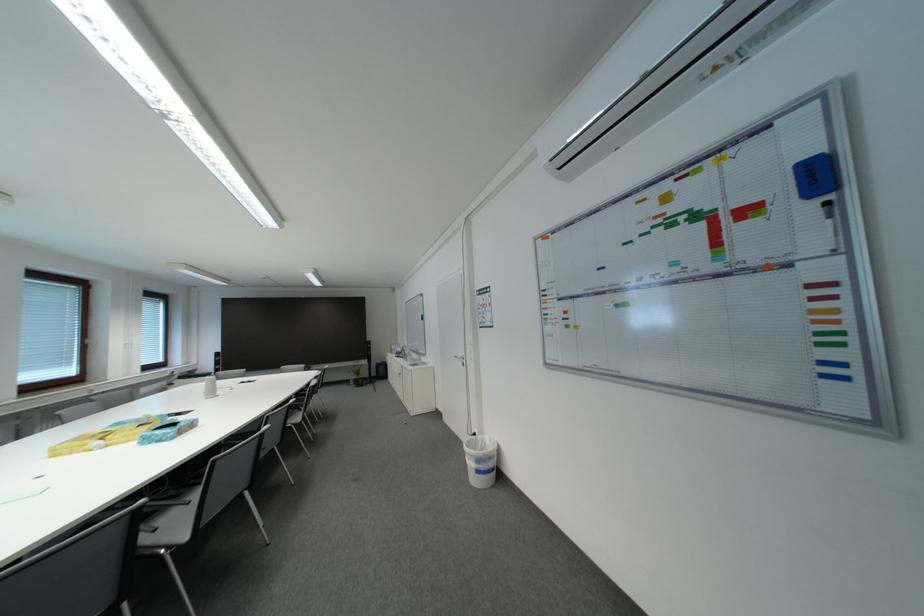
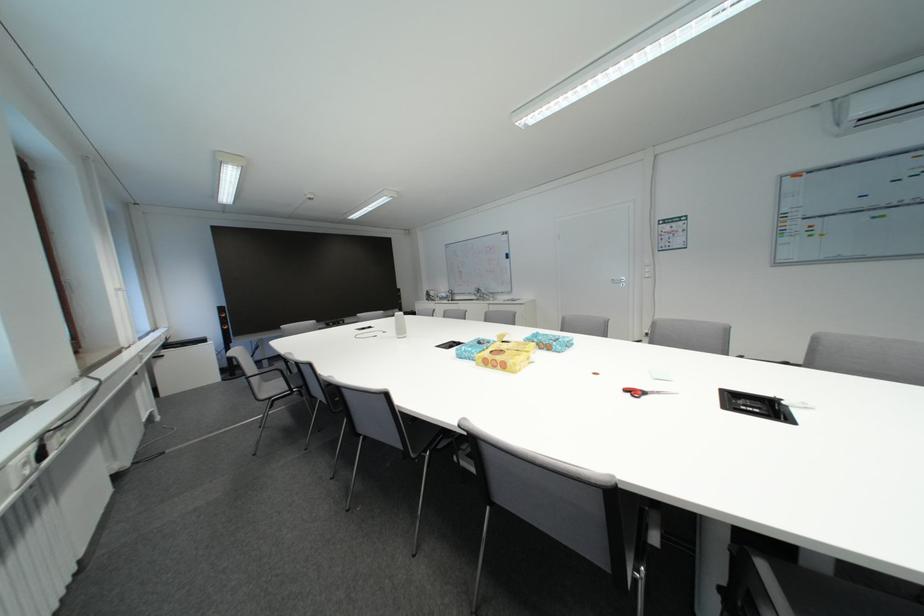
Question: Which direction would the cameraman need to move to produce the second image? Reply with the corresponding letter.

Choices:
 (A) Left
 (B) Right
 (C) Forward
 (D) Backward

Answer: (A)